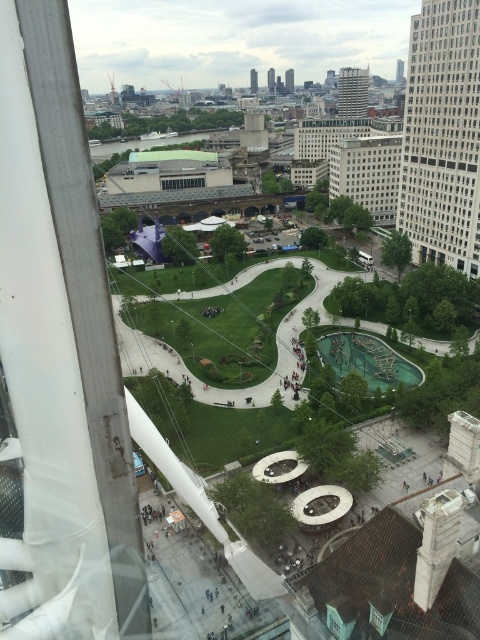
Between white glass building at center and green wooden water park at center, which one has more height?

white glass building at center is taller.

Does white glass building at center have a smaller size compared to green wooden water park at center?

No, white glass building at center is not smaller than green wooden water park at center.

Who is more distant from viewer, (346, 184) or (373, 371)?

The point (346, 184) is more distant.

The height and width of the screenshot is (640, 480). I want to click on white glass building at center, so click(371, 173).

In the scene shown: Can you confirm if white glass building at right is positioned below white glass building at center?

Yes.

Is white glass building at right positioned in front of white glass building at center?

Yes, it is.

Who is more distant from viewer, [456,104] or [386,179]?

Point [386,179]

Where is `white glass building at right`? Image resolution: width=480 pixels, height=640 pixels. white glass building at right is located at coordinates (443, 136).

Where is `green wooden water park at center`? green wooden water park at center is located at coordinates [368, 360].

Who is lower down, green wooden water park at center or clear glass window at center?

green wooden water park at center is below.

What do you see at coordinates (368, 360) in the screenshot?
I see `green wooden water park at center` at bounding box center [368, 360].

Where is `green wooden water park at center`? green wooden water park at center is located at coordinates click(x=368, y=360).